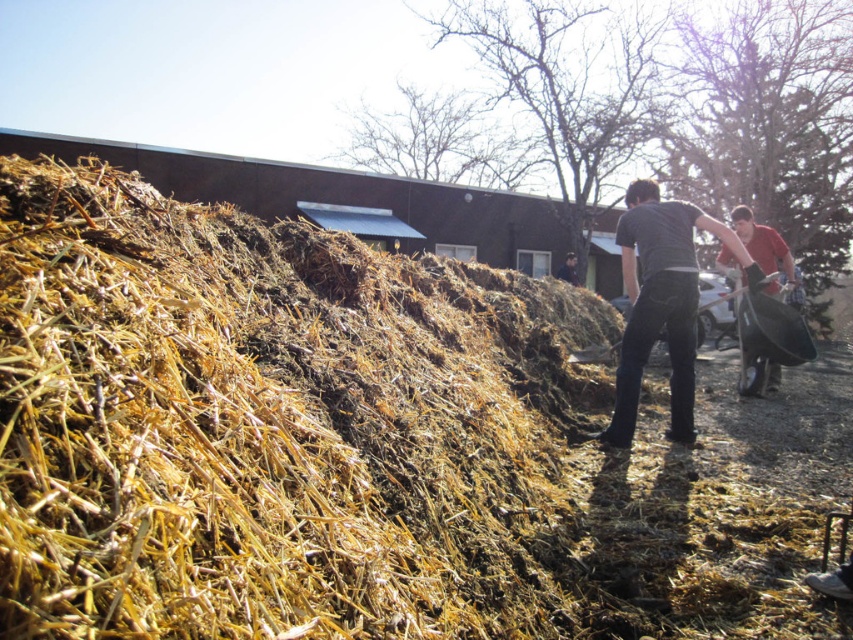
You are a worker in the scene and need to move the brown straw at center to the left side of the matte black shovel at right. Can you do this without moving the shovel?

The brown straw at center is already positioned on the left side of the matte black shovel at right, so you can move the brown straw at center to the left side of the matte black shovel at right without moving the shovel.

You are standing in the outdoor scene and need to move the dark gray shirt at center to the right side of the brown straw at center. Is this possible based on their current positions?

The brown straw at center is currently to the left of the dark gray shirt at center. To move the dark gray shirt at center to the right side of the brown straw at center, you would need to shift the dark gray shirt at center further to the right so that it is positioned to the right of the brown straw at center.